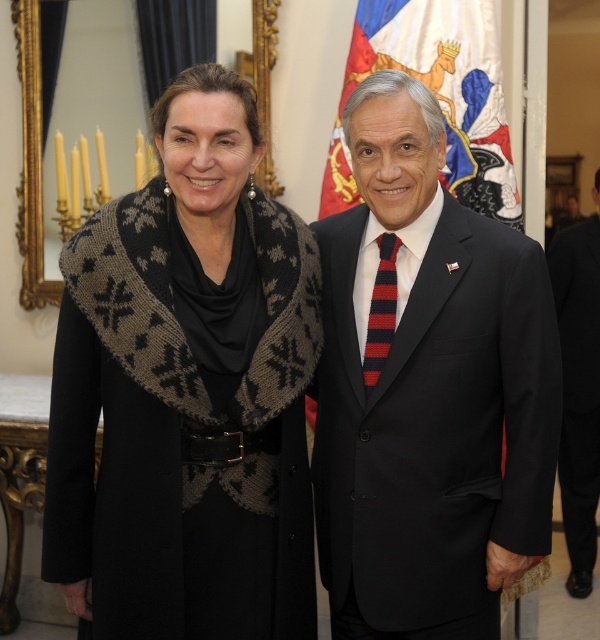
Question: Which point is farther from the camera taking this photo?

Choices:
 (A) (385, 292)
 (B) (553, 250)
 (C) (195, 449)
 (D) (481, 115)

Answer: (B)

Question: Can you confirm if silk flag at upper center is positioned above black wool suit at right?

Choices:
 (A) no
 (B) yes

Answer: (B)

Question: Among these points, which one is nearest to the camera?

Choices:
 (A) (367, 355)
 (B) (319, 556)
 (C) (453, 49)

Answer: (A)

Question: Does black wool suit at center appear under silk flag at upper center?

Choices:
 (A) yes
 (B) no

Answer: (A)

Question: Which object is closer to the camera taking this photo?

Choices:
 (A) black knitted scarf at left
 (B) black wool suit at center
 (C) black wool suit at right

Answer: (A)

Question: Can you confirm if silk flag at upper center is positioned below black wool suit at right?

Choices:
 (A) no
 (B) yes

Answer: (A)